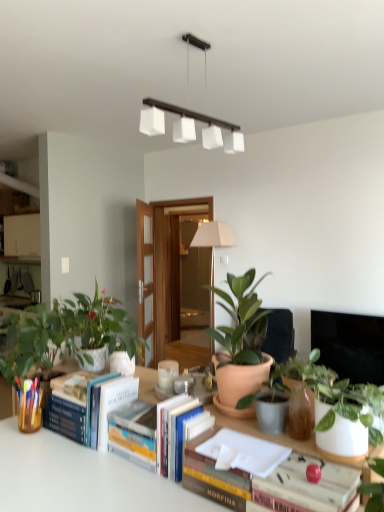
Describe the element at coordinates (146, 430) in the screenshot. I see `hardcover book at center, the 2th book when ordered from front to back` at that location.

What is the approximate width of hardcover book at center, the 2th book when ordered from front to back?

hardcover book at center, the 2th book when ordered from front to back, is 6.99 inches in width.

What do you see at coordinates (241, 339) in the screenshot? I see `green matte plant at center, placed as the third houseplant when sorted from left to right` at bounding box center [241, 339].

What is the approximate height of hardcover book at center, which is the 2th paperback book in left-to-right order?

The height of hardcover book at center, which is the 2th paperback book in left-to-right order, is 8.15 inches.

What do you see at coordinates (114, 403) in the screenshot?
I see `hardcover book at center, arranged as the 2th paperback book when viewed from the right` at bounding box center [114, 403].

The image size is (384, 512). I want to click on flat screen tv at upper right, so click(350, 345).

Where is `white matte rectangular light fixture at upper center`? The image size is (384, 512). white matte rectangular light fixture at upper center is located at coordinates (x=189, y=126).

The width and height of the screenshot is (384, 512). Find the location of `green matte plant at left, positioned as the 1th houseplant in left-to-right order`. green matte plant at left, positioned as the 1th houseplant in left-to-right order is located at coordinates (68, 333).

Looking at this image, between green matte plant at left, positioned as the 1th houseplant in left-to-right order, and hardcover book at center, positioned as the first paperback book in back-to-front order, which one has larger width?

green matte plant at left, positioned as the 1th houseplant in left-to-right order.

From a real-world perspective, relative to hardcover book at center, which appears as the 2th paperback book when viewed from the front, is green matte plant at left, the fifth houseplant positioned from the right, vertically above or below?

From a real-world perspective, green matte plant at left, the fifth houseplant positioned from the right, is physically above hardcover book at center, which appears as the 2th paperback book when viewed from the front.

Which houseplant is the 1st one when counting from the front of the hardcover book at center, arranged as the 2th paperback book when viewed from the right? Please provide its 2D coordinates.

[(68, 333)]

From the image's perspective, does green matte plant at left, positioned as the 1th houseplant in left-to-right order, appear higher than hardcover book at center, which is the 1th paperback book in left-to-right order?

Yes, from the image's perspective, green matte plant at left, positioned as the 1th houseplant in left-to-right order, is over hardcover book at center, which is the 1th paperback book in left-to-right order.

Is point (152, 434) positioned behind point (272, 388)?

Yes, point (152, 434) is farther from viewer.

Is terracotta pot at center, arranged as the fourth houseplant when viewed from the left, at the back of hardcover book at center, the 2th book when ordered from front to back?

No, hardcover book at center, the 2th book when ordered from front to back, is not facing away from terracotta pot at center, arranged as the fourth houseplant when viewed from the left.

Which object is thinner, hardcover book at center, the 2th book when ordered from front to back, or terracotta pot at center, placed as the second houseplant when sorted from right to left?

With smaller width is terracotta pot at center, placed as the second houseplant when sorted from right to left.

Would you say flat screen tv at upper right is to the left or to the right of green glossy plant at center, the 1th houseplant in the right-to-left sequence, in the picture?

flat screen tv at upper right is positioned on green glossy plant at center, the 1th houseplant in the right-to-left sequence,'s right side.

Is flat screen tv at upper right not inside green glossy plant at center, the 1th houseplant in the right-to-left sequence?

Yes, flat screen tv at upper right is not within green glossy plant at center, the 1th houseplant in the right-to-left sequence.

From the picture: Is flat screen tv at upper right not close to green glossy plant at center, which ranks as the fifth houseplant in left-to-right order?

flat screen tv at upper right is positioned a significant distance from green glossy plant at center, which ranks as the fifth houseplant in left-to-right order.

Is point (159, 447) closer or farther from the camera than point (146, 116)?

Point (159, 447) is positioned closer to the camera compared to point (146, 116).

Is hardcover book at center, the 2th book when ordered from front to back, aimed at white matte rectangular light fixture at upper center?

No, hardcover book at center, the 2th book when ordered from front to back, is not turned towards white matte rectangular light fixture at upper center.

Is hardcover book at center, positioned as the first book in back-to-front order, thinner than white matte rectangular light fixture at upper center?

Correct, the width of hardcover book at center, positioned as the first book in back-to-front order, is less than that of white matte rectangular light fixture at upper center.

Is point (256, 407) less distant than point (103, 403)?

Yes.

Is terracotta pot at center, placed as the second houseplant when sorted from right to left, positioned far away from hardcover book at center, which appears as the 2th paperback book when viewed from the front?

No, terracotta pot at center, placed as the second houseplant when sorted from right to left, is not far away from hardcover book at center, which appears as the 2th paperback book when viewed from the front.

Starting from the hardcover book at center, positioned as the first paperback book in back-to-front order, which houseplant is the 2nd one to the right? Please provide its 2D coordinates.

[(269, 402)]

Measure the distance from terracotta pot at center, placed as the second houseplant when sorted from right to left, to white matte table at lower center.

terracotta pot at center, placed as the second houseplant when sorted from right to left, and white matte table at lower center are 43.13 centimeters apart from each other.

From a real-world perspective, which object stands above the other?

terracotta pot at center, placed as the second houseplant when sorted from right to left, from a real-world perspective.

The height and width of the screenshot is (512, 384). In order to click on table lying in front of the terracotta pot at center, arranged as the fourth houseplant when viewed from the left in this screenshot , I will do `click(79, 477)`.

In terms of width, does terracotta pot at center, arranged as the fourth houseplant when viewed from the left, look wider or thinner when compared to white matte table at lower center?

Considering their sizes, terracotta pot at center, arranged as the fourth houseplant when viewed from the left, looks slimmer than white matte table at lower center.

Who is taller, hardcover book at center, which is the 1th paperback book in left-to-right order, or green matte plant at center, placed as the third houseplant when sorted from left to right?

With more height is green matte plant at center, placed as the third houseplant when sorted from left to right.

Is hardcover book at center, which is the 1th paperback book in left-to-right order, positioned with its back to green matte plant at center, placed as the third houseplant when sorted from left to right?

hardcover book at center, which is the 1th paperback book in left-to-right order, is not turned away from green matte plant at center, placed as the third houseplant when sorted from left to right.

Is hardcover book at center, positioned as the first paperback book in back-to-front order, far away from green matte plant at center, placed as the third houseplant when sorted from left to right?

No, there isn't a large distance between hardcover book at center, positioned as the first paperback book in back-to-front order, and green matte plant at center, placed as the third houseplant when sorted from left to right.

The image size is (384, 512). I want to click on the 1st paperback book positioned below the green matte plant at left, positioned as the 1th houseplant in left-to-right order (from the image's perspective), so click(114, 403).

From a real-world perspective, count 1st houseplants upward from the hardcover book at center, arranged as the 1th book when viewed from the left, and point to it. Please provide its 2D coordinates.

[(269, 402)]

Which object lies further to the anchor point hardcover book at center, acting as the 1th paperback book starting from the right, hardcover book at center, which appears as the 2th paperback book when viewed from the front, or green matte plant at center, arranged as the third houseplant when viewed from the right?

hardcover book at center, which appears as the 2th paperback book when viewed from the front, is further to hardcover book at center, acting as the 1th paperback book starting from the right.

Considering their positions, is hardcover book at center, the 2th book when ordered from front to back, positioned further to flat screen tv at upper right than green matte plant at left, positioned as the 1th houseplant in left-to-right order?

Based on the image, hardcover book at center, the 2th book when ordered from front to back, appears to be further to flat screen tv at upper right.

Considering their positions, is hardcover book at center, which is the 2th paperback book in left-to-right order, positioned closer to green glossy plant at center, the 1th houseplant in the right-to-left sequence, than green matte plant at center, placed as the third houseplant when sorted from left to right?

green matte plant at center, placed as the third houseplant when sorted from left to right, lies closer to green glossy plant at center, the 1th houseplant in the right-to-left sequence, than the other object.

Considering their positions, is green matte plant at left, the fifth houseplant positioned from the right, positioned further to terracotta pot at center, arranged as the fourth houseplant when viewed from the left, than white glossy pot at center, the fourth houseplant in the right-to-left sequence?

white glossy pot at center, the fourth houseplant in the right-to-left sequence, is positioned further to the anchor terracotta pot at center, arranged as the fourth houseplant when viewed from the left.

Considering their positions, is hardcover book at center, which is counted as the 2th book, starting from the back, positioned further to green matte plant at left, positioned as the 1th houseplant in left-to-right order, than white matte table at lower center?

hardcover book at center, which is counted as the 2th book, starting from the back, lies further to green matte plant at left, positioned as the 1th houseplant in left-to-right order, than the other object.

Which object lies nearer to the anchor point white matte table at lower center, green matte plant at center, arranged as the third houseplant when viewed from the right, or hardcover book at center, arranged as the 2th paperback book when viewed from the right?

hardcover book at center, arranged as the 2th paperback book when viewed from the right.

Looking at the image, which one is located further to white matte rectangular light fixture at upper center, green glossy plant at center, the 1th houseplant in the right-to-left sequence, or green matte plant at left, the fifth houseplant positioned from the right?

green glossy plant at center, the 1th houseplant in the right-to-left sequence, lies further to white matte rectangular light fixture at upper center than the other object.

From the image, which object appears to be nearer to green matte plant at center, arranged as the third houseplant when viewed from the right, hardcover book at center, which appears as the 2th paperback book when viewed from the front, or green matte plant at left, the fifth houseplant positioned from the right?

Among the two, hardcover book at center, which appears as the 2th paperback book when viewed from the front, is located nearer to green matte plant at center, arranged as the third houseplant when viewed from the right.

Identify the location of paperback book between hardcover book at center, the 2th book when ordered from front to back, and terracotta pot at center, arranged as the fourth houseplant when viewed from the left, from left to right. (185, 436).

This screenshot has width=384, height=512. Find the location of `lamp between white matte table at lower center and flat screen tv at upper right along the z-axis`. lamp between white matte table at lower center and flat screen tv at upper right along the z-axis is located at coordinates (189, 126).

Locate an element on the screen. paperback book between green matte plant at left, the fifth houseplant positioned from the right, and hardcover book at center, positioned as the first book in back-to-front order, in the horizontal direction is located at coordinates (114, 403).

Where is `paperback book located between hardcover book at center, arranged as the 2th paperback book when viewed from the right, and green glossy plant at center, which ranks as the fifth houseplant in left-to-right order, in the left-right direction`? paperback book located between hardcover book at center, arranged as the 2th paperback book when viewed from the right, and green glossy plant at center, which ranks as the fifth houseplant in left-to-right order, in the left-right direction is located at coordinates (185, 436).